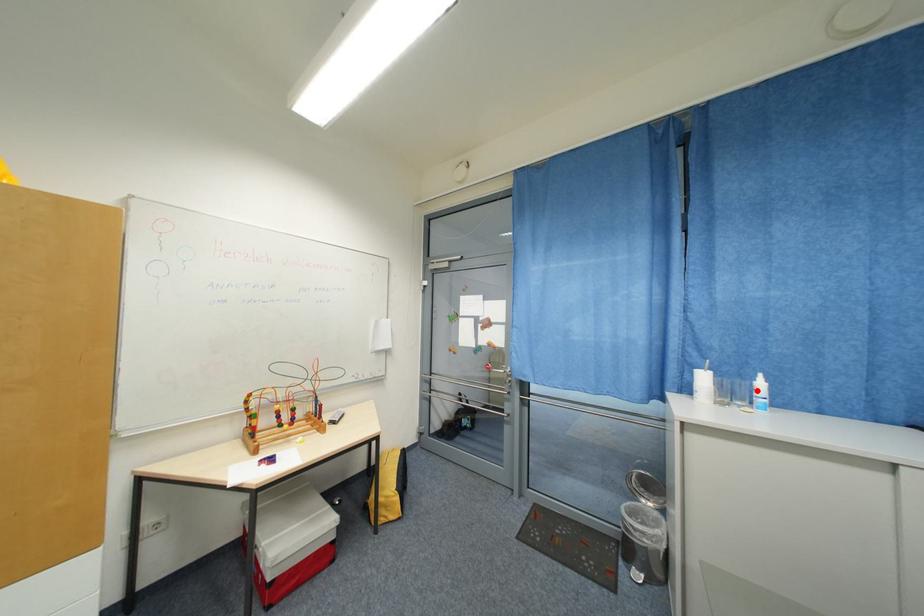
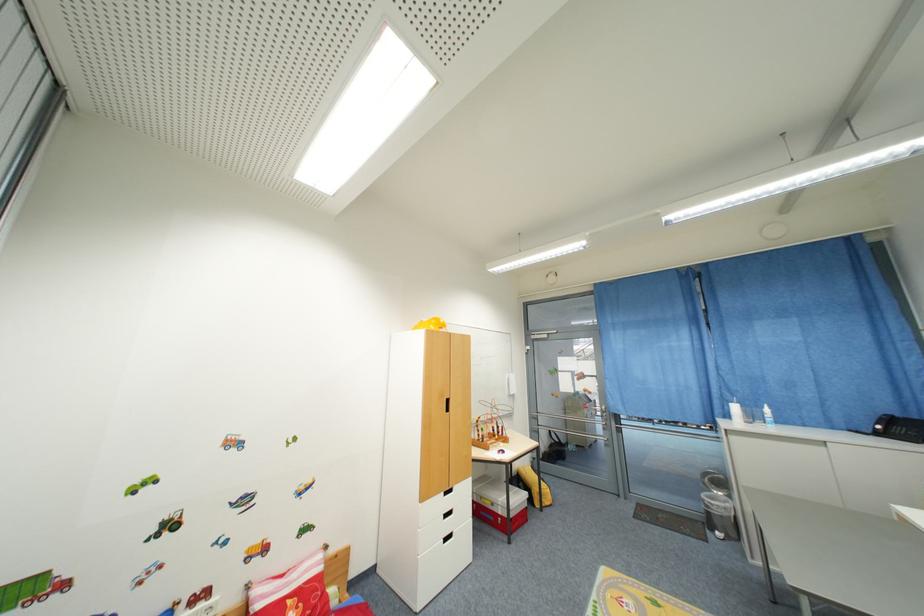
Where in the second image is the point corresponding to the highlighted location from the first image?

(768, 415)